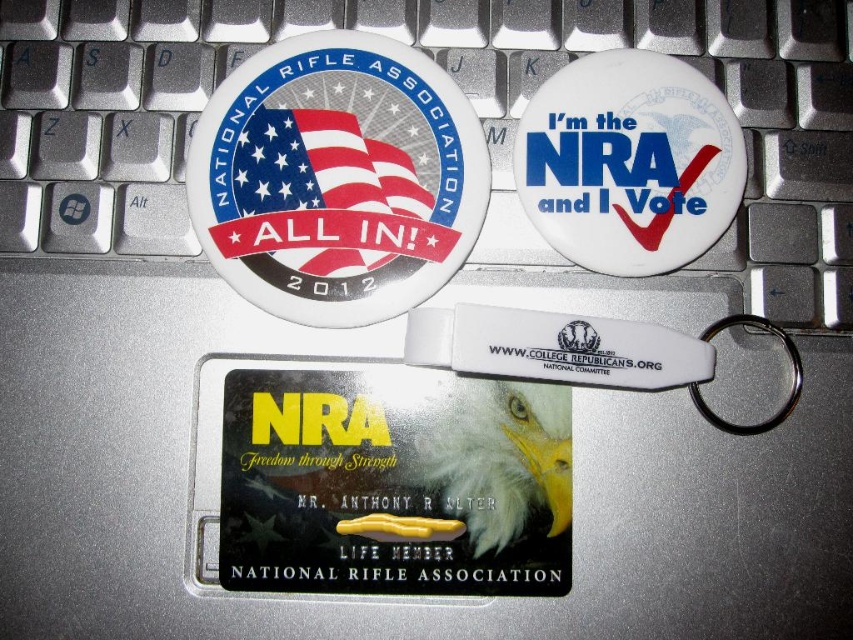
You are organizing a display of NRA items on a table. You have a matte white button at center and a white plastic keychain at center. Which item is closer to you when both are placed on the table?

The matte white button at center is closer to you because it is further to the viewer than the white plastic keychain at center.